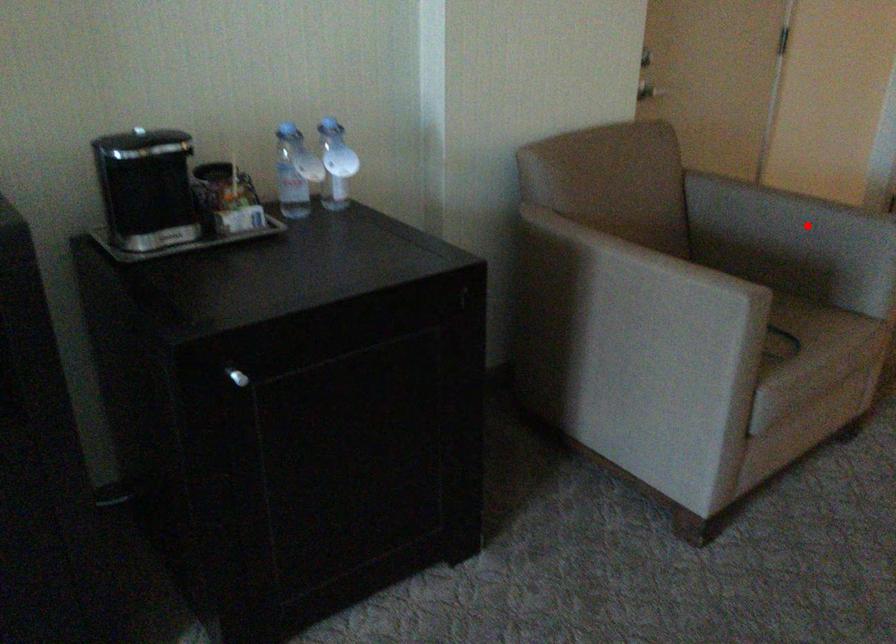
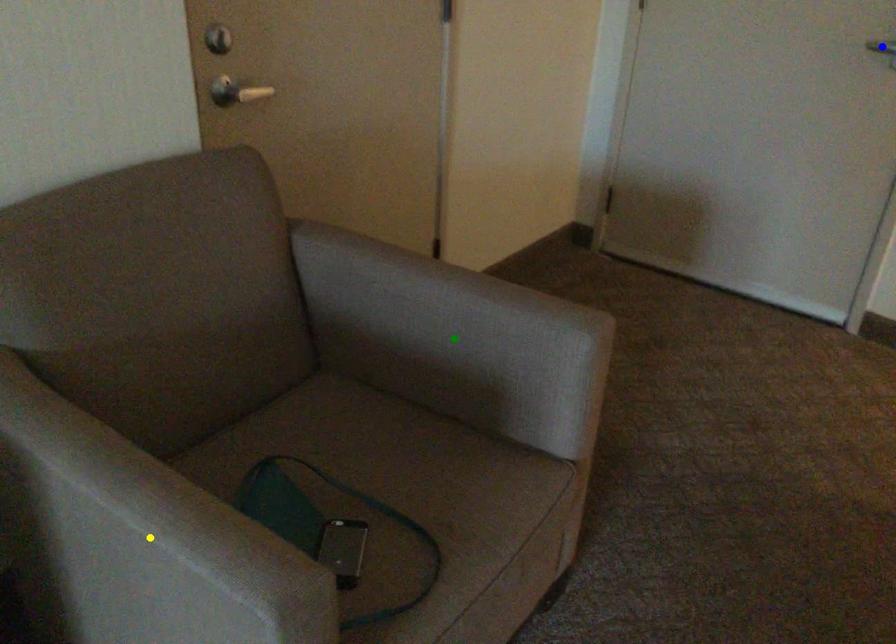
Question: I am providing you with two images of the same scene from different viewpoints. A red point is marked on the first image. You are given multiple points on the second image. In image 2, which mark is for the same physical point as the one in image 1?

Choices:
 (A) blue point
 (B) green point
 (C) yellow point

Answer: (B)